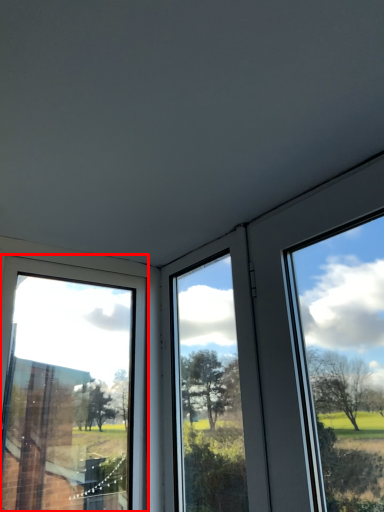
Question: Considering the relative positions of window (annotated by the red box) and window in the image provided, where is window (annotated by the red box) located with respect to the staircase?

Choices:
 (A) left
 (B) right

Answer: (A)